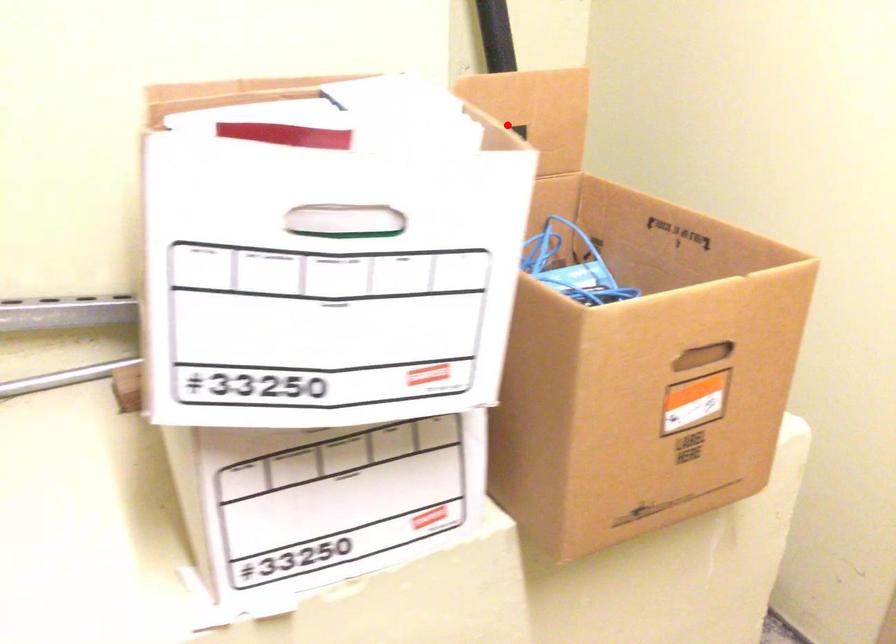
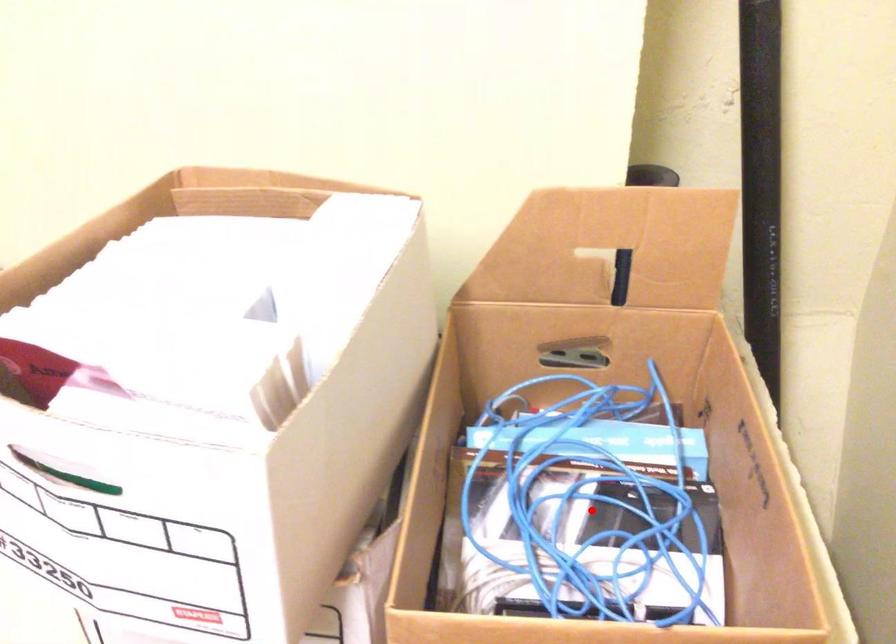
I am providing you with two images of the same scene from different viewpoints. A red point is marked on the first image and another point is marked on the second image. Are the points marked in image1 and image2 representing the same 3D position?

No